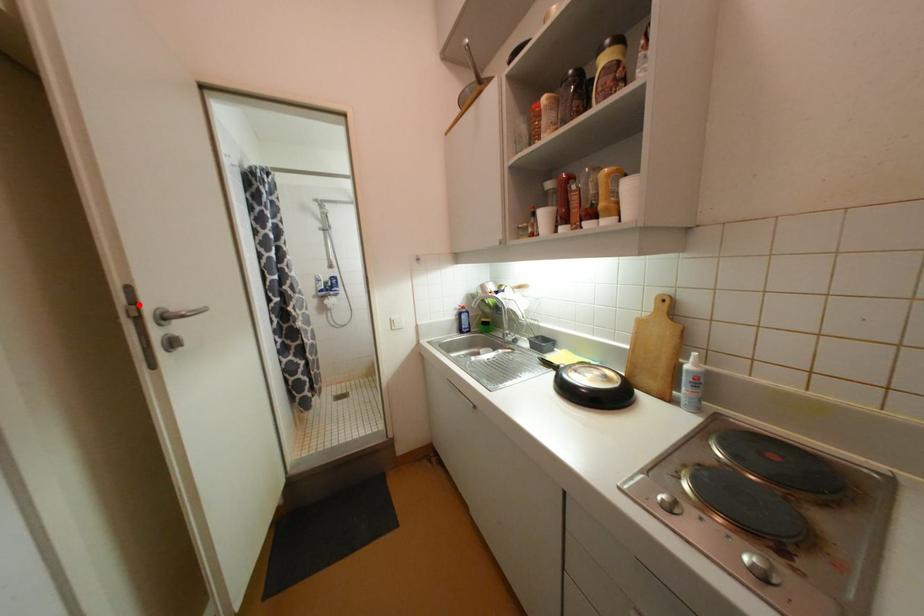
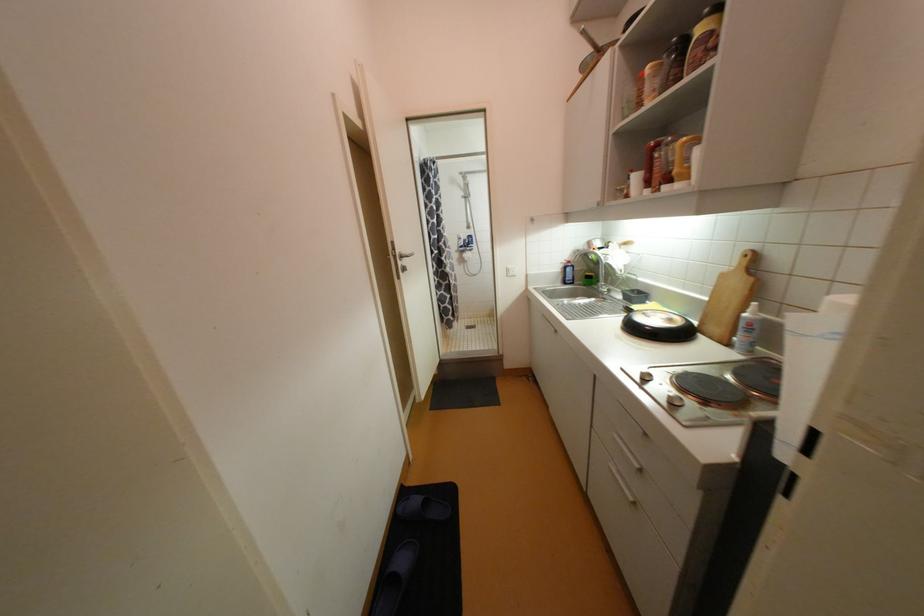
Question: I am providing you with two images of the same scene from different viewpoints. A red point is marked on the first image. Can you still see the location of the red point in image 2?

Choices:
 (A) Yes
 (B) No

Answer: (A)